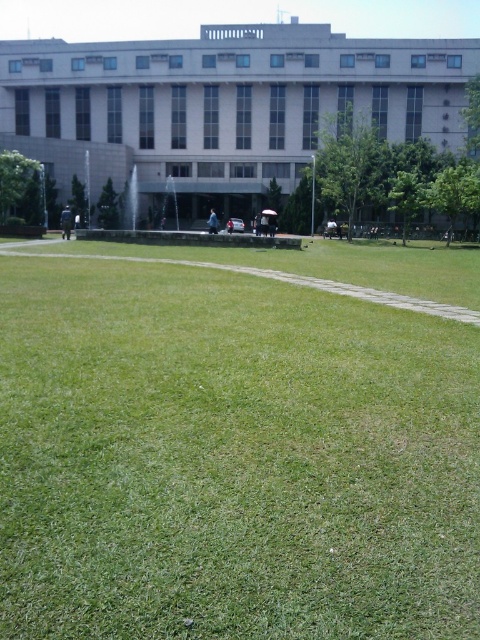
You are standing in the middle of the green grassy field at center and want to walk to the white concrete building at upper center. Which direction should you head to get closer to the building?

Since the green grassy field at center is closer to the viewer than the white concrete building at upper center, you should head towards the upper direction to move closer to the white concrete building at upper center.

You are standing at the entrance of the building and want to walk to the green grassy field at center. Is the distance less than 10 feet?

The distance of green grassy field at center from camera is 10.01 feet, so the distance is more than 10 feet.